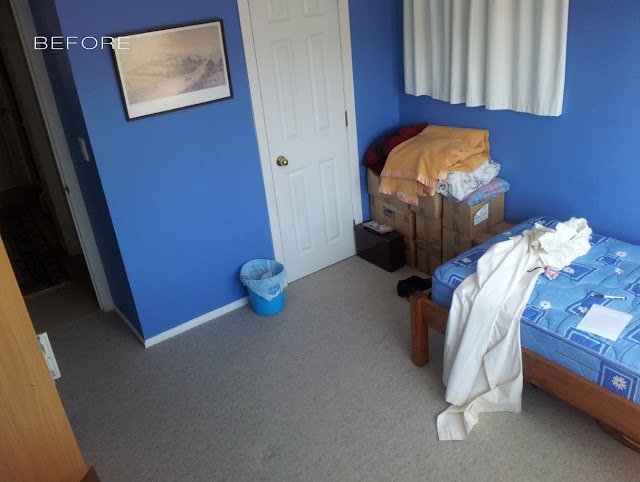
You are a GUI agent. You are given a task and a screenshot of the screen. Output one action in this format:
    pyautogui.click(x=<x>, y=<y>)
    Task: Click on the painting on wall
    The width and height of the screenshot is (640, 482).
    Given the screenshot: What is the action you would take?
    pyautogui.click(x=180, y=82)